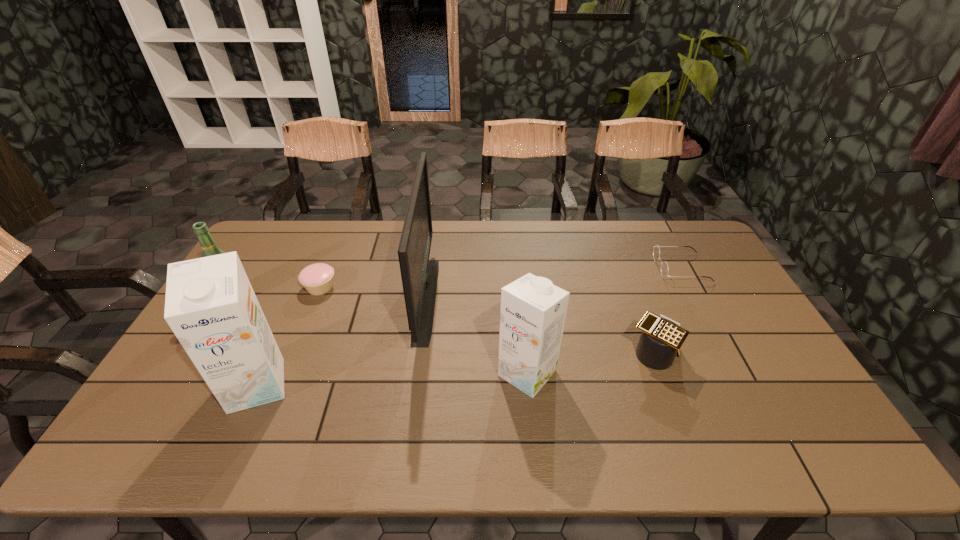
Locate an element on the screen. The width and height of the screenshot is (960, 540). the taller carton is located at coordinates (210, 305).

In order to click on the fifth object from left to right in this screenshot , I will do `click(532, 315)`.

Locate an element on the screen. This screenshot has width=960, height=540. the shorter carton is located at coordinates (532, 315).

What are the coordinates of `the rightmost object` in the screenshot? It's located at (664, 269).

Locate an element on the screen. the shortest object is located at coordinates (664, 269).

The width and height of the screenshot is (960, 540). I want to click on calculator, so click(661, 338).

Locate an element on the screen. the third shortest object is located at coordinates (661, 338).

What are the coordinates of `monitor` in the screenshot? It's located at (419, 275).

Locate an element on the screen. Image resolution: width=960 pixels, height=540 pixels. beer bottle is located at coordinates (208, 245).

Where is `cupcake`? The image size is (960, 540). cupcake is located at coordinates (317, 279).